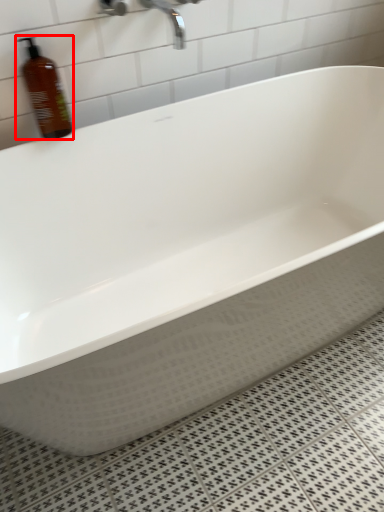
Question: From the image's perspective, what is the correct spatial relationship of bottle (annotated by the red box) in relation to faucet?

Choices:
 (A) above
 (B) below

Answer: (B)